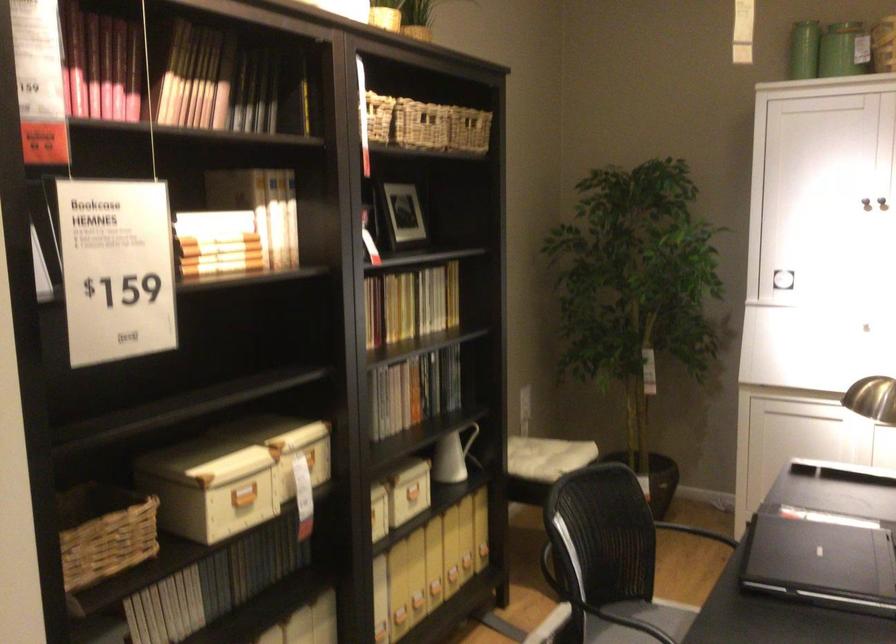
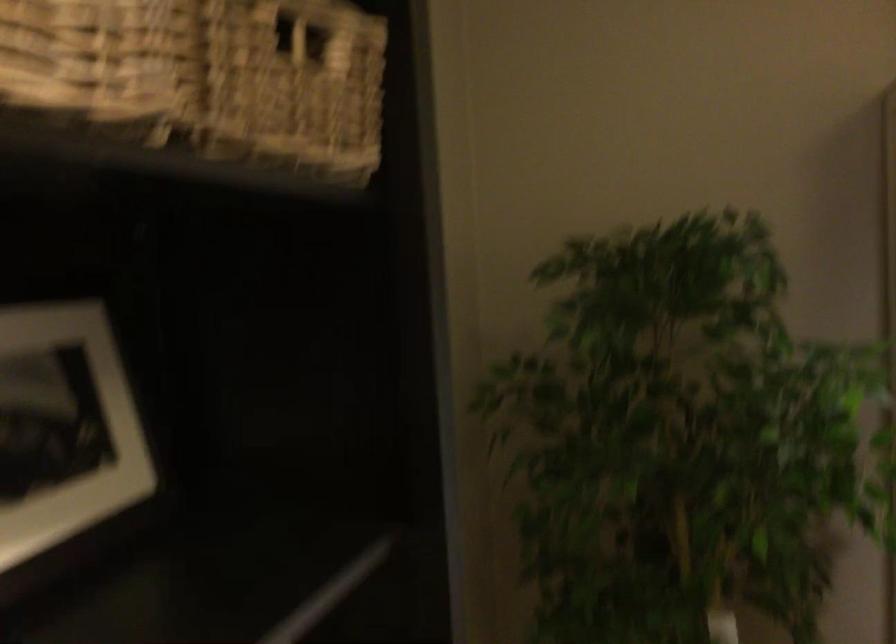
The point at (462, 135) is marked in the first image. Where is the corresponding point in the second image?

(291, 91)